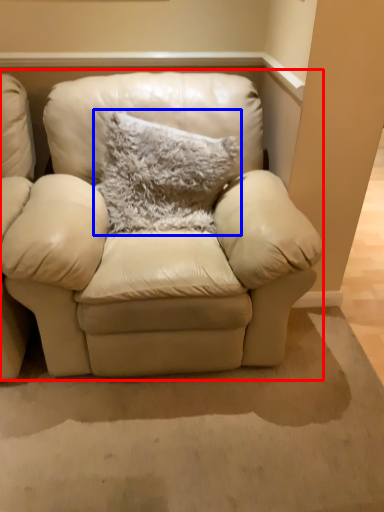
Question: Which point is closer to the camera, studio couch (highlighted by a red box) or pillow (highlighted by a blue box)?

Choices:
 (A) studio couch
 (B) pillow

Answer: (A)